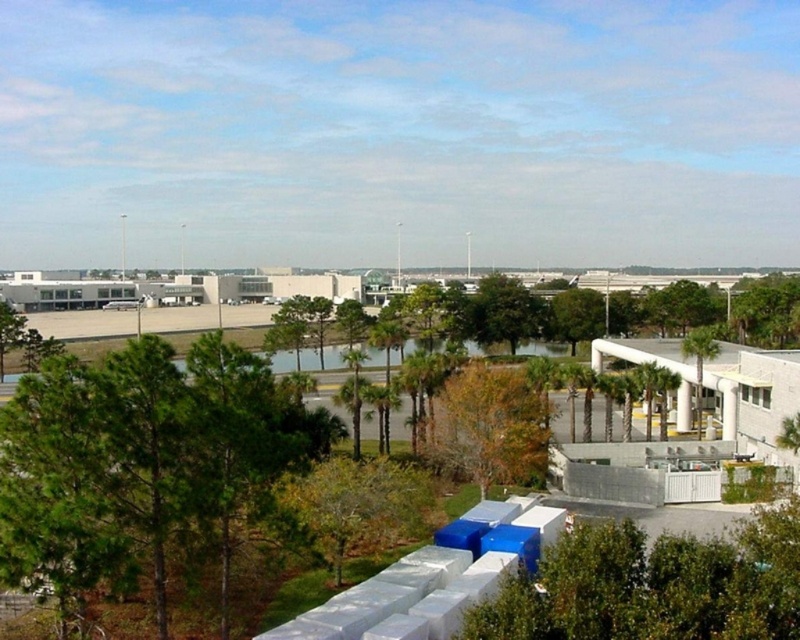
Question: Among these points, which one is nearest to the camera?

Choices:
 (A) (700, 372)
 (B) (708, 628)
 (C) (525, 428)

Answer: (B)

Question: Which object is farther from the camera taking this photo?

Choices:
 (A) brown leafy tree at center
 (B) green leafy tree at lower right
 (C) green leafy palm tree at center-right

Answer: (C)

Question: Is brown leafy tree at center further to camera compared to green leafy palm tree at center-right?

Choices:
 (A) yes
 (B) no

Answer: (B)

Question: Which of the following is the farthest from the observer?

Choices:
 (A) green leafy tree at lower right
 (B) green leafy palm tree at center-right

Answer: (B)

Question: Can you confirm if brown leafy tree at center is positioned to the right of green leafy palm tree at center-right?

Choices:
 (A) yes
 (B) no

Answer: (B)

Question: Is green leafy tree at lower right bigger than brown leafy tree at center?

Choices:
 (A) no
 (B) yes

Answer: (A)